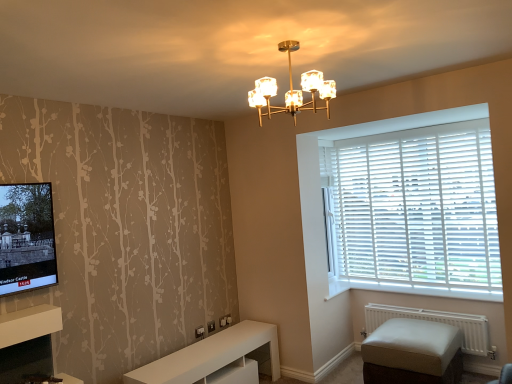
Question: Visually, is beige fabric ottoman at lower right positioned to the left or to the right of white matte radiator at lower right?

Choices:
 (A) left
 (B) right

Answer: (A)

Question: From the image's perspective, is beige fabric ottoman at lower right positioned above or below white matte radiator at lower right?

Choices:
 (A) above
 (B) below

Answer: (B)

Question: Based on their relative distances, which object is nearer to the gold metallic chandelier at upper center?

Choices:
 (A) white wood at lower right
 (B) beige fabric ottoman at lower right
 (C) white wood blinds at right
 (D) white glossy cabinet at lower center
 (E) white matte radiator at lower right

Answer: (C)

Question: Which is farther from the gold metallic chandelier at upper center?

Choices:
 (A) white wood blinds at right
 (B) white matte radiator at lower right
 (C) beige fabric ottoman at lower right
 (D) white glossy cabinet at lower center
 (E) white wood at lower right

Answer: (B)